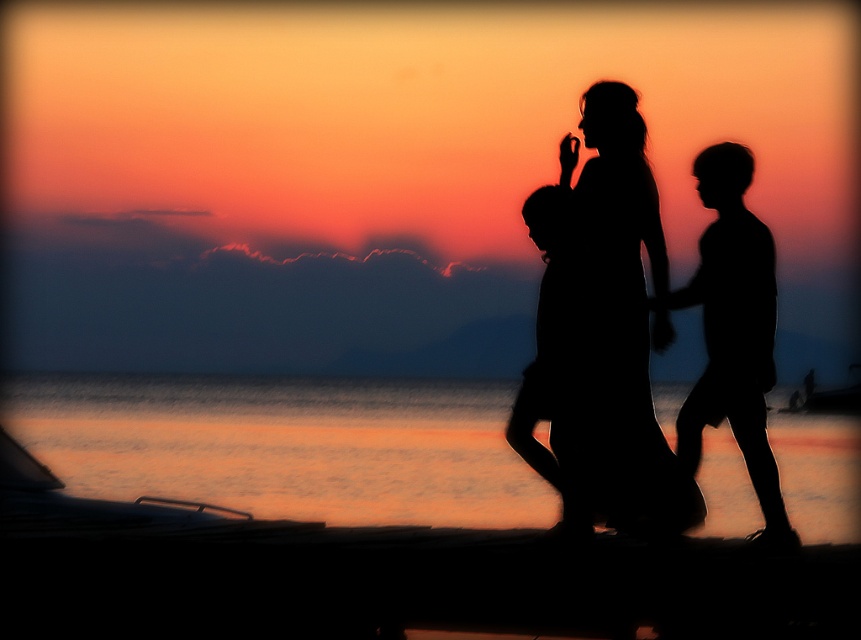
Question: Among these objects, which one is farthest from the camera?

Choices:
 (A) silhouette dress at center
 (B) silhouette child at center
 (C) black matte figure at right

Answer: (B)

Question: Does orange water at lower center come behind black matte figure at right?

Choices:
 (A) no
 (B) yes

Answer: (B)

Question: Does black matte figure at right appear under silhouette child at center?

Choices:
 (A) yes
 (B) no

Answer: (A)

Question: Is silhouette dress at center to the left of black matte figure at right from the viewer's perspective?

Choices:
 (A) yes
 (B) no

Answer: (A)

Question: Which object appears closest to the camera in this image?

Choices:
 (A) black matte figure at right
 (B) silhouette child at center
 (C) orange water at lower center
 (D) silhouette dress at center

Answer: (D)

Question: Which point appears farthest from the camera in this image?

Choices:
 (A) click(x=579, y=522)
 (B) click(x=11, y=401)
 (C) click(x=643, y=195)
 (D) click(x=748, y=244)

Answer: (B)